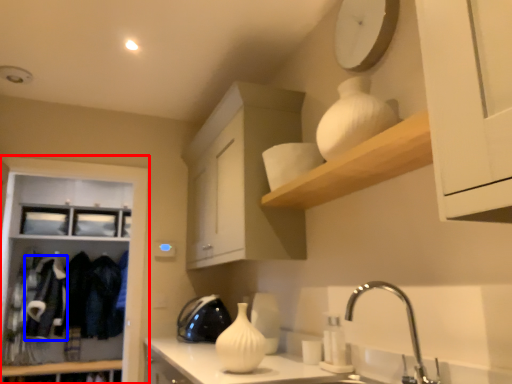
Question: Among these objects, which one is farthest to the camera, cabinetry (highlighted by a red box) or laundry (highlighted by a blue box)?

Choices:
 (A) cabinetry
 (B) laundry

Answer: (B)